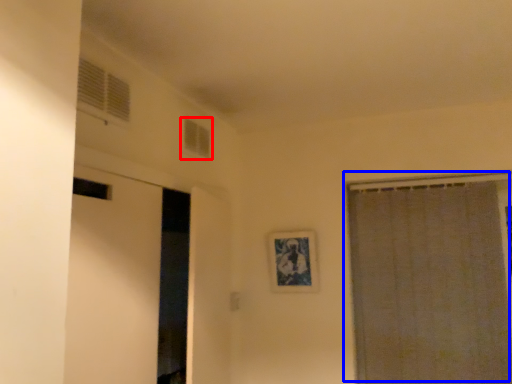
Question: Which of the following is the closest to the observer, window (highlighted by a red box) or curtain (highlighted by a blue box)?

Choices:
 (A) window
 (B) curtain

Answer: (A)